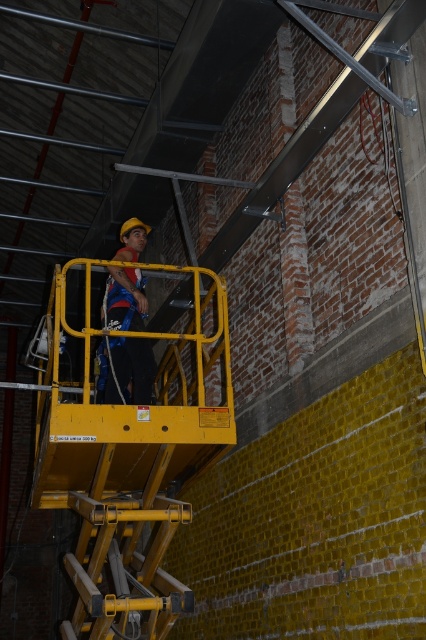
Who is positioned more to the right, yellow metallic platform at center or matte blue safety harness at center?

From the viewer's perspective, matte blue safety harness at center appears more on the right side.

Is yellow metallic platform at center positioned before matte blue safety harness at center?

Yes, yellow metallic platform at center is closer to the viewer.

Is point (129, 262) positioned behind point (143, 344)?

No, it is not.

Identify the location of yellow metallic platform at center. (127, 461).